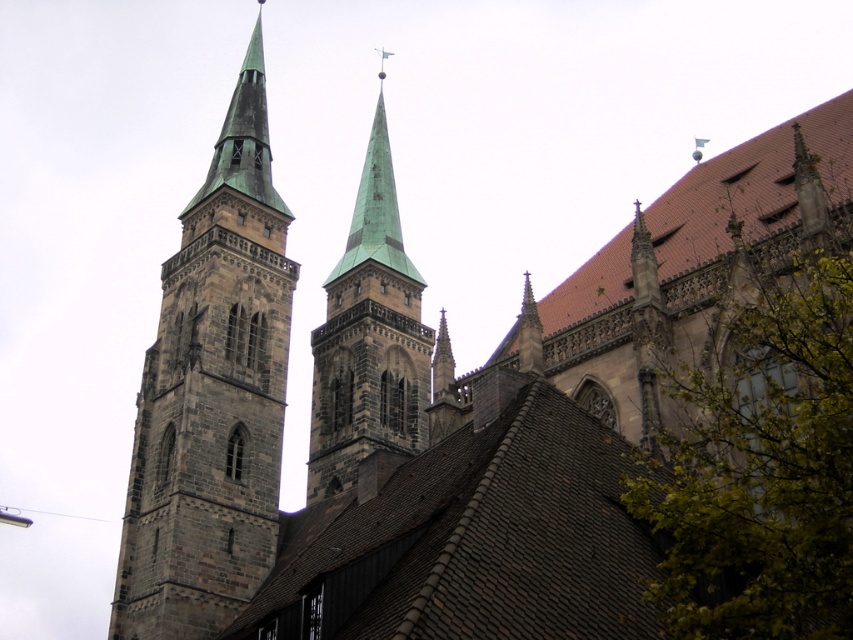
Question: Does green leafy tree at right have a larger size compared to dark gray stone tower at left?

Choices:
 (A) yes
 (B) no

Answer: (B)

Question: Does green leafy tree at right appear on the right side of dark gray stone tower at left?

Choices:
 (A) yes
 (B) no

Answer: (A)

Question: Which object is positioned closest to the green copper steeple at center?

Choices:
 (A) dark gray stone tower at left
 (B) green leafy tree at right

Answer: (A)

Question: Which point is closer to the camera?

Choices:
 (A) (704, 506)
 (B) (387, 184)
 (C) (199, 410)

Answer: (A)

Question: Which of the following is the farthest from the observer?

Choices:
 (A) (654, 493)
 (B) (181, 268)

Answer: (B)

Question: Does dark gray stone tower at left have a greater width compared to green copper steeple at center?

Choices:
 (A) no
 (B) yes

Answer: (B)